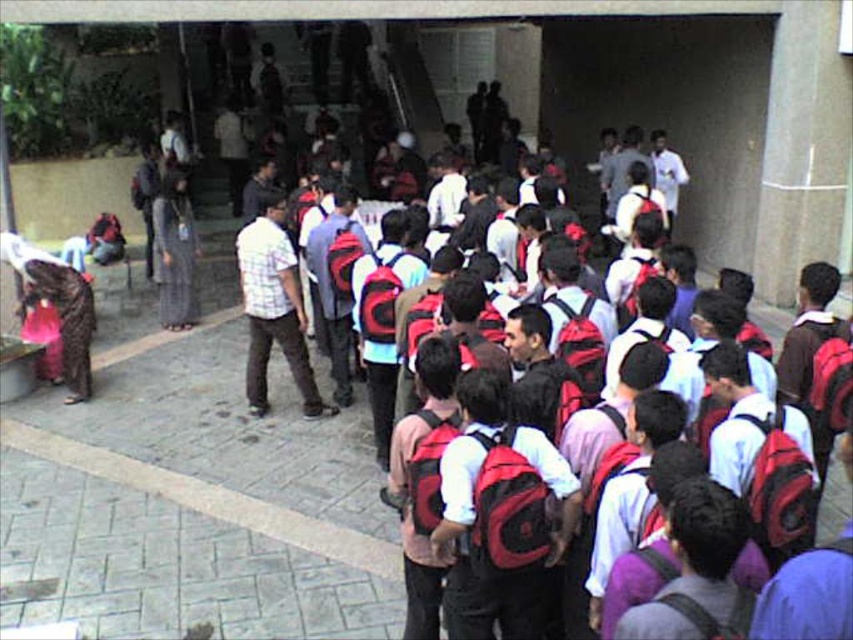
In the scene shown: Is matte red backpack at center above plaid shirt at center?

No.

Does matte red backpack at center have a smaller size compared to plaid shirt at center?

Correct, matte red backpack at center occupies less space than plaid shirt at center.

This screenshot has width=853, height=640. Describe the element at coordinates (480, 554) in the screenshot. I see `matte red backpack at center` at that location.

Identify the location of matte red backpack at center. (480, 554).

Does matte red backpack at center appear on the left side of gray concrete line at lower center?

Incorrect, matte red backpack at center is not on the left side of gray concrete line at lower center.

Can you confirm if matte red backpack at center is positioned below gray concrete line at lower center?

Incorrect, matte red backpack at center is not positioned below gray concrete line at lower center.

The image size is (853, 640). What are the coordinates of `matte red backpack at center` in the screenshot? It's located at (480, 554).

Is gray concrete line at lower center shorter than plaid shirt at center?

Correct, gray concrete line at lower center is not as tall as plaid shirt at center.

Is gray concrete line at lower center thinner than plaid shirt at center?

In fact, gray concrete line at lower center might be wider than plaid shirt at center.

Which is in front, point (186, 496) or point (262, 333)?

Point (186, 496)

Identify the location of gray concrete line at lower center. (209, 499).